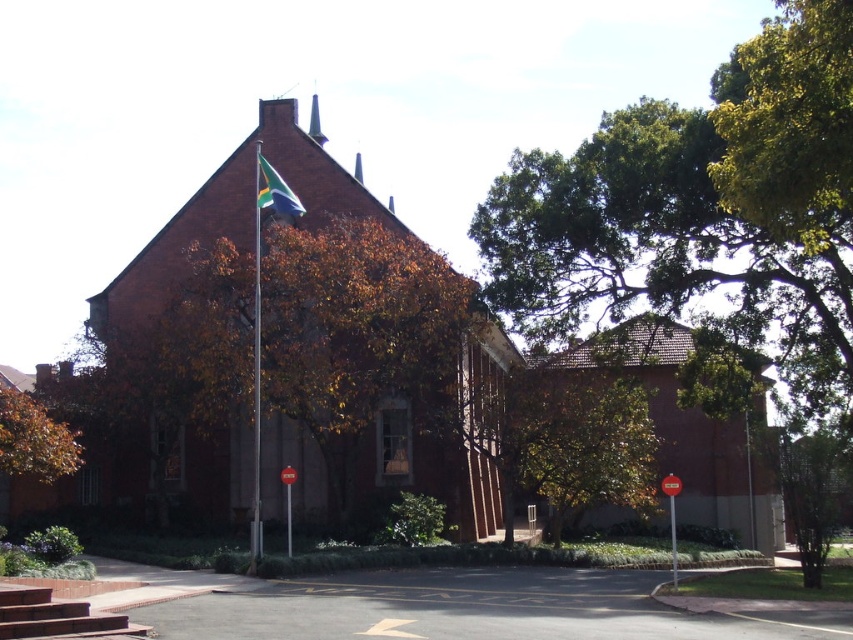
Based on the photo, you are standing at the entrance of the large, red brick building. You want to walk to the green leafy tree at center. Which direction should you go?

The green leafy tree at center is located at point (579, 440), which is to the center of the image. Since you are at the entrance, you should walk forward towards the center area to reach the green leafy tree at center.